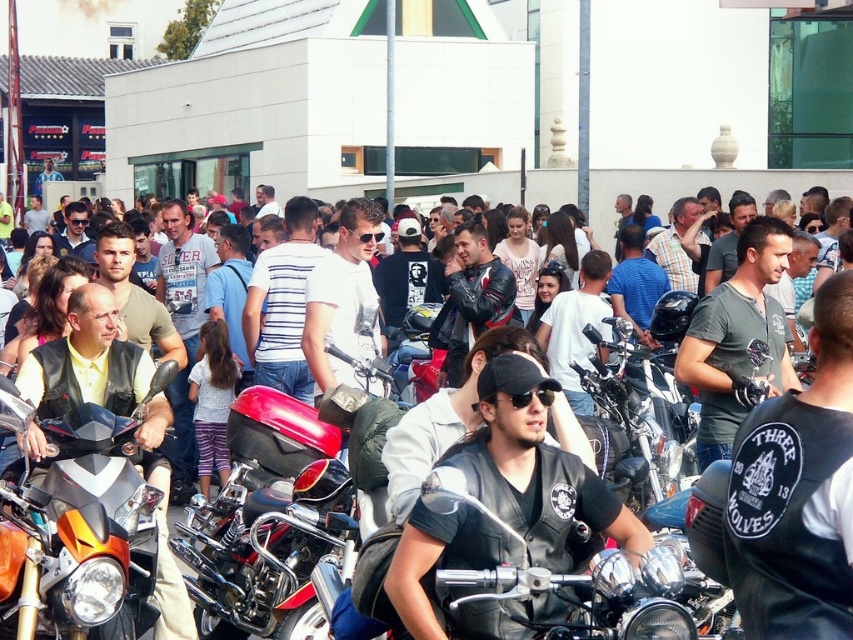
Based on the photo, which is more to the left, shiny red motorcycle at center or orange matte motorcycle at center?

orange matte motorcycle at center is more to the left.

What do you see at coordinates (265, 518) in the screenshot? I see `shiny red motorcycle at center` at bounding box center [265, 518].

Locate an element on the screen. shiny red motorcycle at center is located at coordinates (265, 518).

Is leather jacket at center shorter than shiny chrome motorcycle at center?

Yes.

This screenshot has height=640, width=853. I want to click on leather jacket at center, so click(x=502, y=509).

Which is in front, point (643, 540) or point (572, 360)?

Point (643, 540) is more forward.

Where is `leather jacket at center`? This screenshot has width=853, height=640. leather jacket at center is located at coordinates (502, 509).

Can you confirm if shiny red motorcycle at center is thinner than shiny chrome motorcycle at center?

In fact, shiny red motorcycle at center might be wider than shiny chrome motorcycle at center.

Does point (288, 532) lie in front of point (653, 435)?

Yes, point (288, 532) is in front of point (653, 435).

The width and height of the screenshot is (853, 640). I want to click on shiny red motorcycle at center, so click(265, 518).